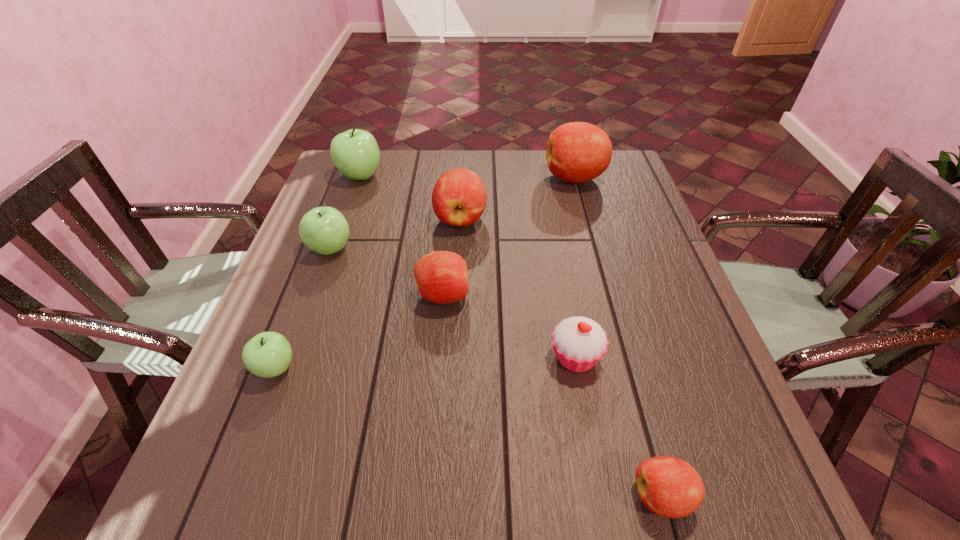
The width and height of the screenshot is (960, 540). Identify the location of red apple that is the second closest one to the pink cupcake. (441, 276).

This screenshot has width=960, height=540. I want to click on red apple that is the closest one to the nearest object, so click(441, 276).

You are a GUI agent. You are given a task and a screenshot of the screen. Output one action in this format:
    pyautogui.click(x=<x>, y=<y>)
    Task: Click on the green apple that is the closest to the pink cupcake
    Image resolution: width=960 pixels, height=540 pixels.
    Given the screenshot: What is the action you would take?
    pyautogui.click(x=268, y=354)

In order to click on green apple object that ranks as the third closest to the third biggest red apple in this screenshot , I will do `click(355, 153)`.

At what (x,y) coordinates should I click in order to perform the action: click on free space that satisfies the following two spatial constraints: 1. on the front side of the cupcake; 2. on the left side of the biggest green apple. Please return your answer as a coordinate pair (x, y). The height and width of the screenshot is (540, 960). Looking at the image, I should click on (297, 357).